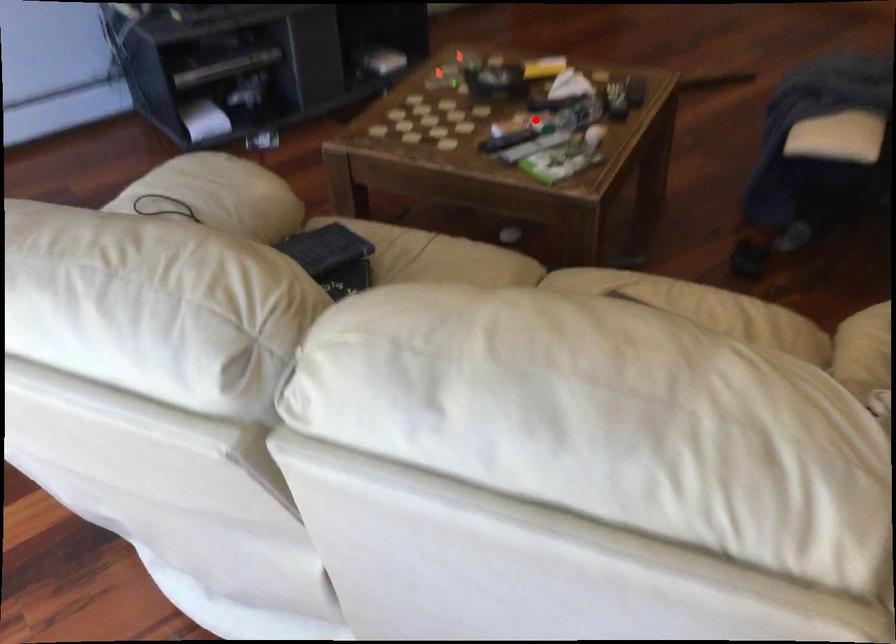
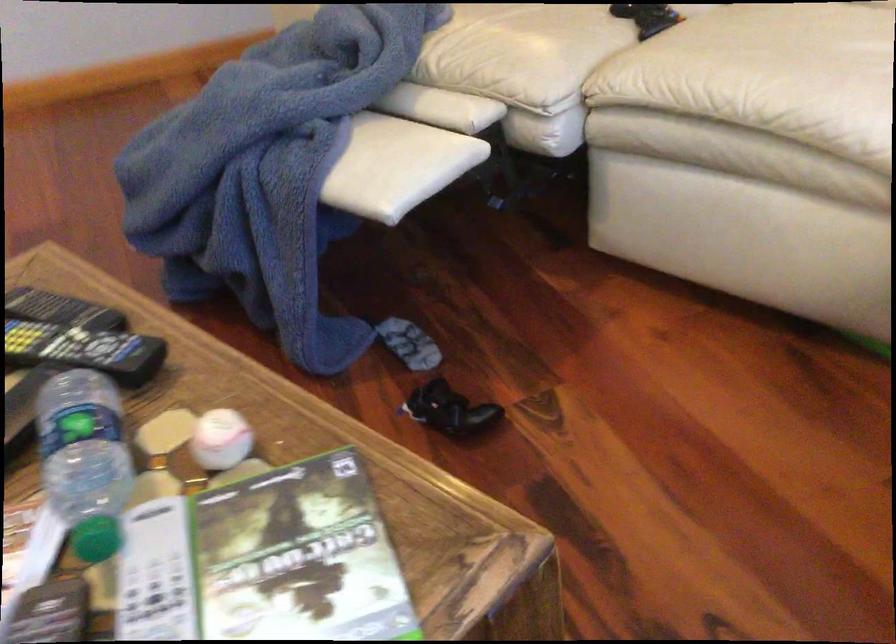
The point at the highlighted location is marked in the first image. Where is the corresponding point in the second image?

(96, 538)